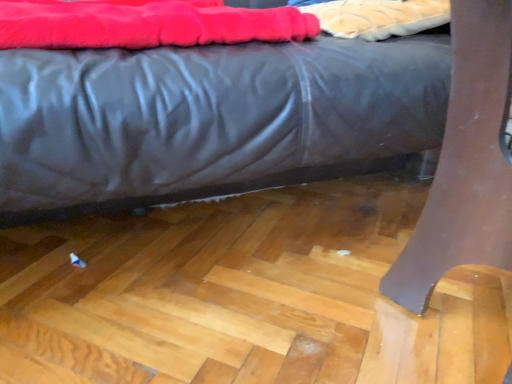
Question: From a real-world perspective, is matte black bed at center physically located above or below velvet-like fabric at upper center?

Choices:
 (A) below
 (B) above

Answer: (A)

Question: Does point (155, 192) appear closer or farther from the camera than point (386, 28)?

Choices:
 (A) farther
 (B) closer

Answer: (B)

Question: Which is farther from the velvet-like fabric at upper center?

Choices:
 (A) velvet-like red blanket at upper left
 (B) matte black bed at center

Answer: (A)

Question: Which object is the farthest from the velvet-like red blanket at upper left?

Choices:
 (A) velvet-like fabric at upper center
 (B) matte black bed at center

Answer: (A)